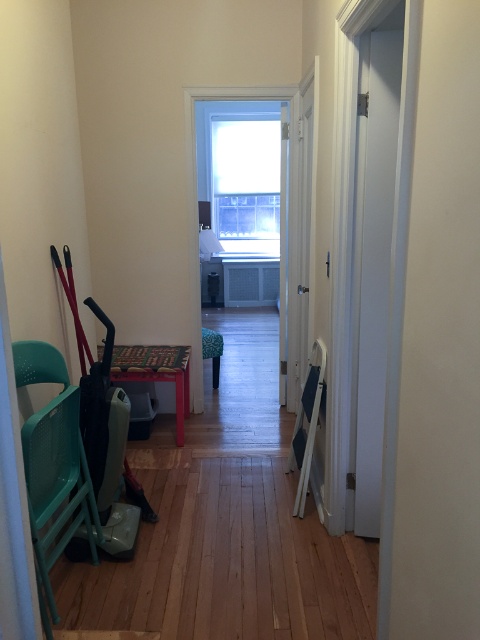
You are standing at the entrance of the hallway and want to sit down. Which object, the teal plastic chair at left or the green fabric stool at center, is closer to you?

The teal plastic chair at left is closer to you because it is located below the green fabric stool at center, meaning it is positioned lower and nearer in the hallway.

You are moving a 50 cm wide painting and want to place it between the wooden table at center and the green fabric stool at center in the hallway. Will the painting fit in the space between them?

The distance between the wooden table at center and the green fabric stool at center is 51.53 centimeters. Since the painting is 50 cm wide, it will fit with approximately 1.53 centimeters of space remaining.

You are moving a teal plastic chair at left and a wooden table at center through a doorway that is 1 meter wide. Can both items fit through the doorway side by side?

The teal plastic chair at left has a lesser width compared to wooden table at center. Since the teal plastic chair at left is narrower than the wooden table at center, and the doorway is 1 meter wide, it is possible that both items can fit through the doorway side by side if their combined widths do not exceed 1 meter. However, without knowing the exact width of the wooden table at center, we cannot confirm for certain.